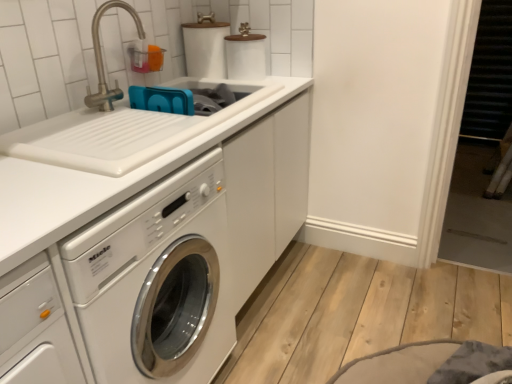
Locate an element on the screen. brushed metal faucet at upper left is located at coordinates (102, 60).

What do you see at coordinates (156, 281) in the screenshot? I see `white glossy washing machine at center-left` at bounding box center [156, 281].

I want to click on white glossy sink at upper left, so click(95, 185).

How distant is white glossy sink at upper left from white matte toilet paper at upper center?

57.76 centimeters.

Which of these two, white glossy sink at upper left or white matte toilet paper at upper center, is thinner?

white matte toilet paper at upper center.

Is white glossy sink at upper left far from white matte toilet paper at upper center?

No, white glossy sink at upper left is not far away from white matte toilet paper at upper center.

Could you tell me if white glossy sink at upper left is facing white matte toilet paper at upper center?

No, white glossy sink at upper left is not turned towards white matte toilet paper at upper center.

Would you consider white matte toilet paper at upper center to be distant from brushed metal faucet at upper left?

No, white matte toilet paper at upper center is in close proximity to brushed metal faucet at upper left.

From the image's perspective, is white matte toilet paper at upper center above brushed metal faucet at upper left?

Yes, from the image's perspective, white matte toilet paper at upper center is on top of brushed metal faucet at upper left.

Can you tell me how much white matte toilet paper at upper center and brushed metal faucet at upper left differ in facing direction?

The angle between the facing direction of white matte toilet paper at upper center and the facing direction of brushed metal faucet at upper left is 0.155 degrees.

Considering the sizes of objects brushed metal faucet at upper left and white matte toilet paper at upper center in the image provided, who is shorter, brushed metal faucet at upper left or white matte toilet paper at upper center?

With less height is white matte toilet paper at upper center.

From a real-world perspective, is brushed metal faucet at upper left positioned above or below white matte toilet paper at upper center?

From a real-world perspective, brushed metal faucet at upper left is physically above white matte toilet paper at upper center.

Between brushed metal faucet at upper left and white matte toilet paper at upper center, which one is positioned behind?

Positioned behind is white matte toilet paper at upper center.

From the image's perspective, does brushed metal faucet at upper left appear higher than white matte toilet paper at upper center?

No, from the image's perspective, brushed metal faucet at upper left is not on top of white matte toilet paper at upper center.

From a real-world perspective, is brushed metal faucet at upper left positioned above or below white glossy sink at upper left?

In terms of real-world spatial position, brushed metal faucet at upper left is above white glossy sink at upper left.

Could you tell me if brushed metal faucet at upper left is turned towards white glossy sink at upper left?

Yes, brushed metal faucet at upper left is aimed at white glossy sink at upper left.

Where is `counter top in front of the brushed metal faucet at upper left`? The height and width of the screenshot is (384, 512). counter top in front of the brushed metal faucet at upper left is located at coordinates (95, 185).

From a real-world perspective, is white matte toilet paper at upper center physically below white glossy sink at upper left?

No, from a real-world perspective, white matte toilet paper at upper center is not under white glossy sink at upper left.

Is white matte toilet paper at upper center not close to white glossy sink at upper left?

Actually, white matte toilet paper at upper center and white glossy sink at upper left are a little close together.

Considering the sizes of objects white matte toilet paper at upper center and white glossy sink at upper left in the image provided, who is shorter, white matte toilet paper at upper center or white glossy sink at upper left?

With less height is white glossy sink at upper left.

What are the coordinates of `counter top located on the left of white matte toilet paper at upper center` in the screenshot? It's located at (95, 185).

Looking at this image, which of these two, white glossy washing machine at center-left or brushed metal faucet at upper left, stands taller?

white glossy washing machine at center-left.

From a real-world perspective, is white glossy washing machine at center-left on top of brushed metal faucet at upper left?

Incorrect, from a real-world perspective, white glossy washing machine at center-left is lower than brushed metal faucet at upper left.

Is white glossy washing machine at center-left positioned before brushed metal faucet at upper left?

Yes, it is in front of brushed metal faucet at upper left.

Find the location of a particular element. This screenshot has height=384, width=512. faucet above the white glossy washing machine at center-left (from the image's perspective) is located at coordinates (102, 60).

Is white glossy sink at upper left in front of or behind brushed metal faucet at upper left in the image?

Visually, white glossy sink at upper left is located in front of brushed metal faucet at upper left.

What are the coordinates of `faucet behind the white glossy sink at upper left` in the screenshot? It's located at (102, 60).

Considering the relative sizes of white glossy sink at upper left and brushed metal faucet at upper left in the image provided, is white glossy sink at upper left bigger than brushed metal faucet at upper left?

Correct, white glossy sink at upper left is larger in size than brushed metal faucet at upper left.

You are a GUI agent. You are given a task and a screenshot of the screen. Output one action in this format:
    pyautogui.click(x=<x>, y=<y>)
    Task: Click on the toilet paper above the white glossy sink at upper left (from a real-world perspective)
    The image size is (512, 384).
    Given the screenshot: What is the action you would take?
    pyautogui.click(x=205, y=48)

This screenshot has height=384, width=512. Find the location of `faucet below the white matte toilet paper at upper center (from the image's perspective)`. faucet below the white matte toilet paper at upper center (from the image's perspective) is located at coordinates (102, 60).

Based on their spatial positions, is white glossy washing machine at center-left or white glossy sink at upper left further from white matte toilet paper at upper center?

Among the two, white glossy washing machine at center-left is located further to white matte toilet paper at upper center.

Estimate the real-world distances between objects in this image. Which object is closer to white glossy sink at upper left, brushed metal faucet at upper left or white glossy washing machine at center-left?

The object closer to white glossy sink at upper left is white glossy washing machine at center-left.

Based on their spatial positions, is white matte toilet paper at upper center or white glossy sink at upper left further from white glossy washing machine at center-left?

The object further to white glossy washing machine at center-left is white matte toilet paper at upper center.

Looking at the image, which one is located closer to white glossy sink at upper left, white matte toilet paper at upper center or white glossy washing machine at center-left?

white glossy washing machine at center-left is positioned closer to the anchor white glossy sink at upper left.

Looking at the image, which one is located further to white glossy washing machine at center-left, brushed metal faucet at upper left or white matte toilet paper at upper center?

Based on the image, white matte toilet paper at upper center appears to be further to white glossy washing machine at center-left.

Considering their positions, is brushed metal faucet at upper left positioned further to white glossy sink at upper left than white matte toilet paper at upper center?

The object further to white glossy sink at upper left is brushed metal faucet at upper left.

When comparing their distances from brushed metal faucet at upper left, does white glossy washing machine at center-left or white matte toilet paper at upper center seem closer?

white matte toilet paper at upper center lies closer to brushed metal faucet at upper left than the other object.

Looking at this image, estimate the real-world distances between objects in this image. Which object is further from white matte toilet paper at upper center, white glossy washing machine at center-left or brushed metal faucet at upper left?

Based on the image, white glossy washing machine at center-left appears to be further to white matte toilet paper at upper center.

The height and width of the screenshot is (384, 512). I want to click on faucet that lies between white matte toilet paper at upper center and white glossy washing machine at center-left from top to bottom, so click(x=102, y=60).

Image resolution: width=512 pixels, height=384 pixels. I want to click on faucet between white glossy sink at upper left and white matte toilet paper at upper center in the front-back direction, so click(x=102, y=60).

What are the coordinates of `counter top between brushed metal faucet at upper left and white glossy washing machine at center-left in the vertical direction` in the screenshot? It's located at (95, 185).

At what (x,y) coordinates should I click in order to perform the action: click on counter top positioned between white glossy washing machine at center-left and white matte toilet paper at upper center from near to far. Please return your answer as a coordinate pair (x, y). The width and height of the screenshot is (512, 384). Looking at the image, I should click on (95, 185).